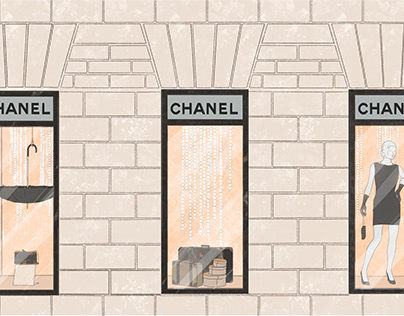
Where is `middle window`? The height and width of the screenshot is (316, 404). middle window is located at coordinates (221, 200).